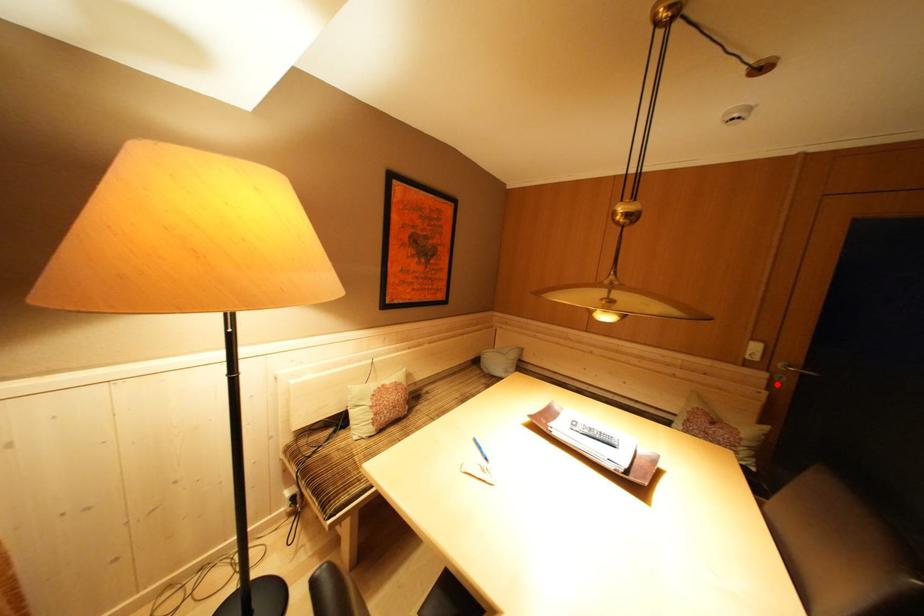
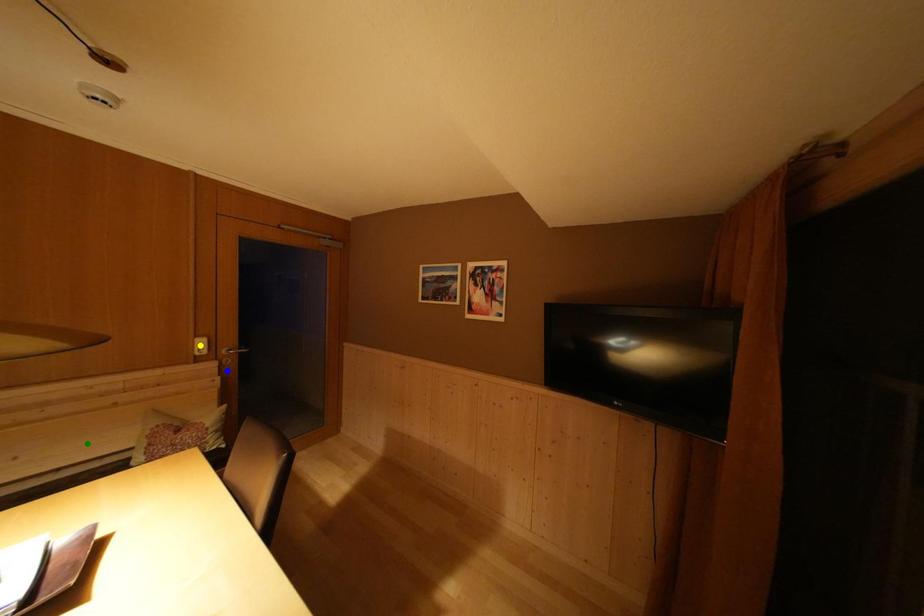
Question: I am providing you with two images of the same scene from different viewpoints. A red point is marked on the first image. You are given multiple points on the second image. Can you choose the point in image 2 that corresponds to the point in image 1?

Choices:
 (A) green point
 (B) yellow point
 (C) blue point

Answer: (C)